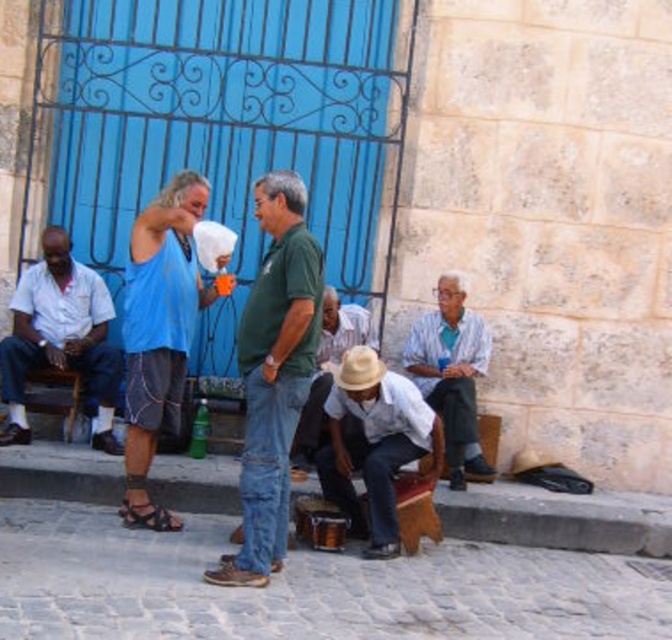
Question: Which of the following is the closest to the observer?

Choices:
 (A) (265, 349)
 (B) (526, 563)
 (C) (126, 432)
 (D) (362, 356)

Answer: (A)

Question: Can you confirm if smooth stone curb at lower center is positioned above blue fabric shirt at center?

Choices:
 (A) yes
 (B) no

Answer: (B)

Question: Estimate the real-world distances between objects in this image. Which object is farther from the cobblestone pavement at lower center?

Choices:
 (A) white straw hat at center
 (B) white striped shirt at center
 (C) white cotton shirt at left
 (D) green matte shirt at center

Answer: (C)

Question: Can you confirm if blue fabric shirt at center is positioned to the right of light brown straw hat at center?

Choices:
 (A) yes
 (B) no

Answer: (B)

Question: Does smooth stone curb at lower center appear over brown leather sandal at lower left?

Choices:
 (A) yes
 (B) no

Answer: (A)

Question: Which point is farther to the camera?

Choices:
 (A) (351, 305)
 (B) (239, 340)

Answer: (A)